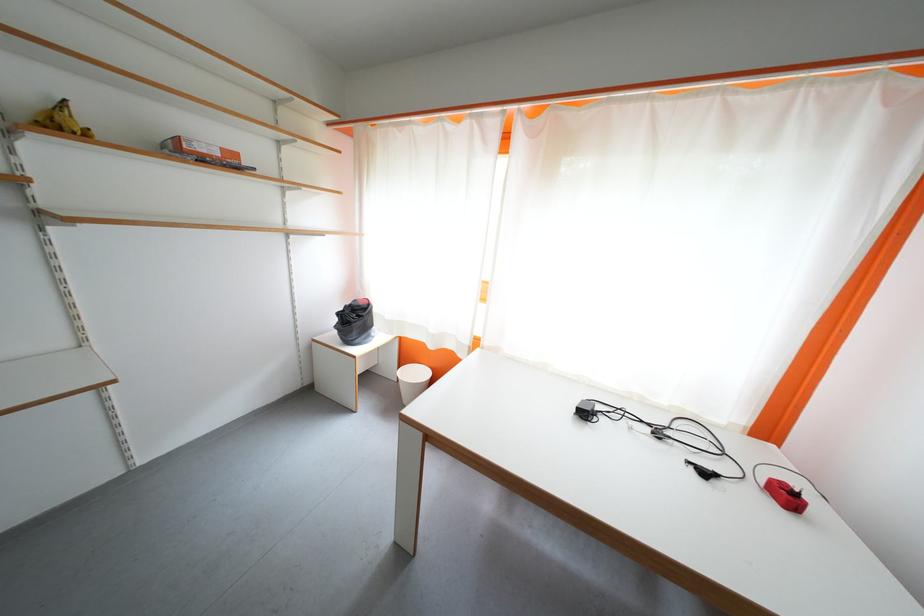
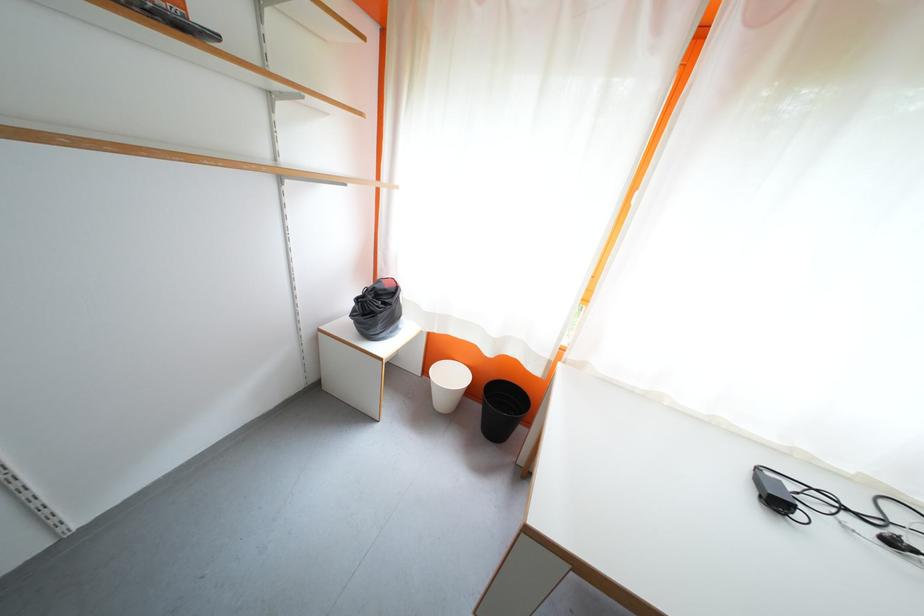
What movement of the cameraman would produce the second image?

The movement direction of the cameraman is left, forward.